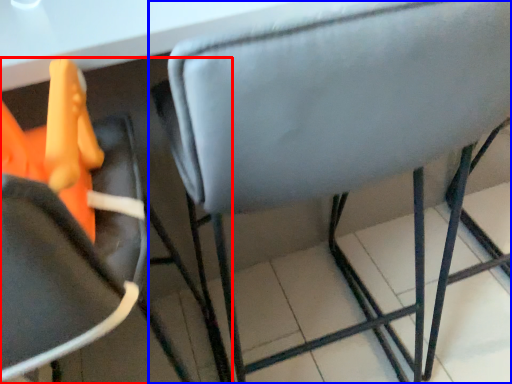
Question: Which object appears closest to the camera in this image, chair (highlighted by a red box) or chair (highlighted by a blue box)?

Choices:
 (A) chair
 (B) chair

Answer: (A)